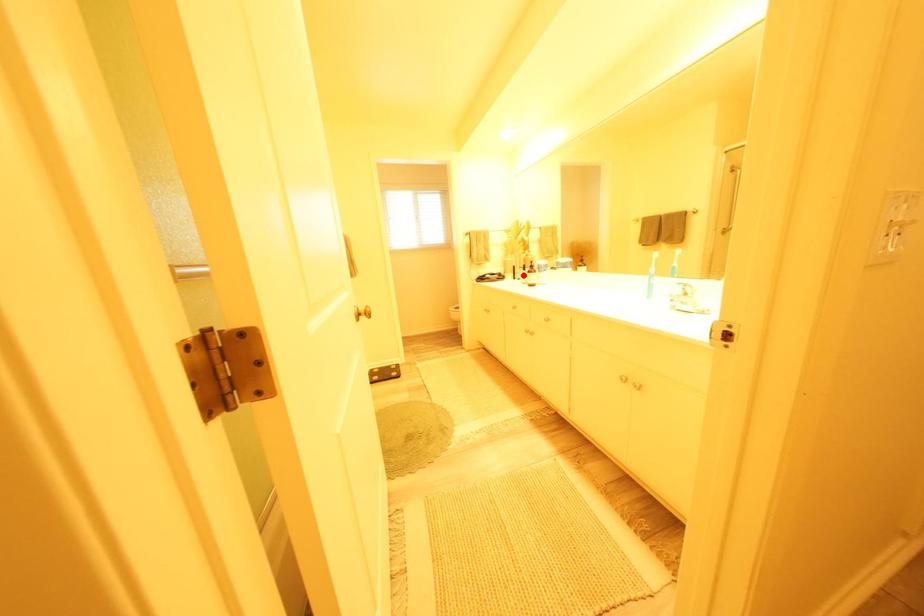
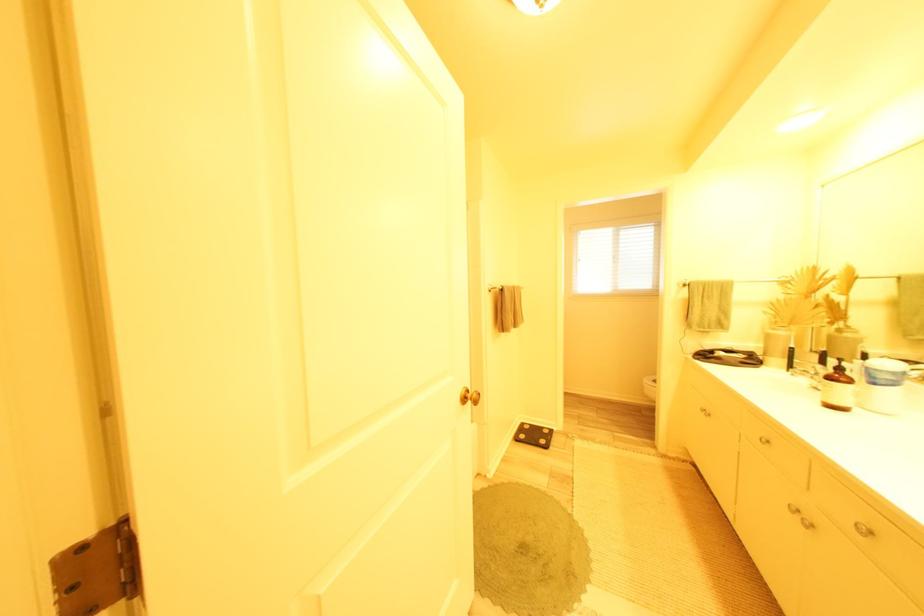
Locate, in the second image, the point that corresponds to the highlighted location in the first image.

(796, 362)